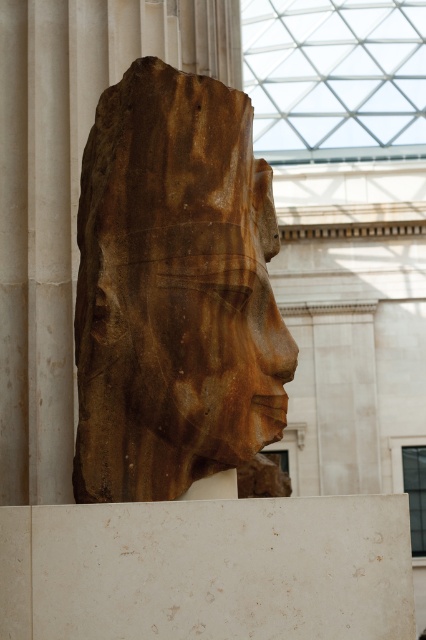
You are an art conservator examining the brown stone head at center and the brown stone face at center displayed on a pedestal. Which object has a greater width?

The brown stone head at center might be wider than brown stone face at center according to the description provided.

You are a tour guide explaining the sculpture to visitors. You mention the brown stone head at center and the brown stone face at center. Which one is positioned to the left?

The brown stone head at center is positioned to the left of the brown stone face at center.

You are an art student standing in front of the sculpture. You need to sketch the brown stone head at center. Where should you position yourself to capture its central features?

The brown stone head at center is located at point 2D coordinates [173,289], so you should position yourself directly in front of the sculpture at its central point to capture its central features.